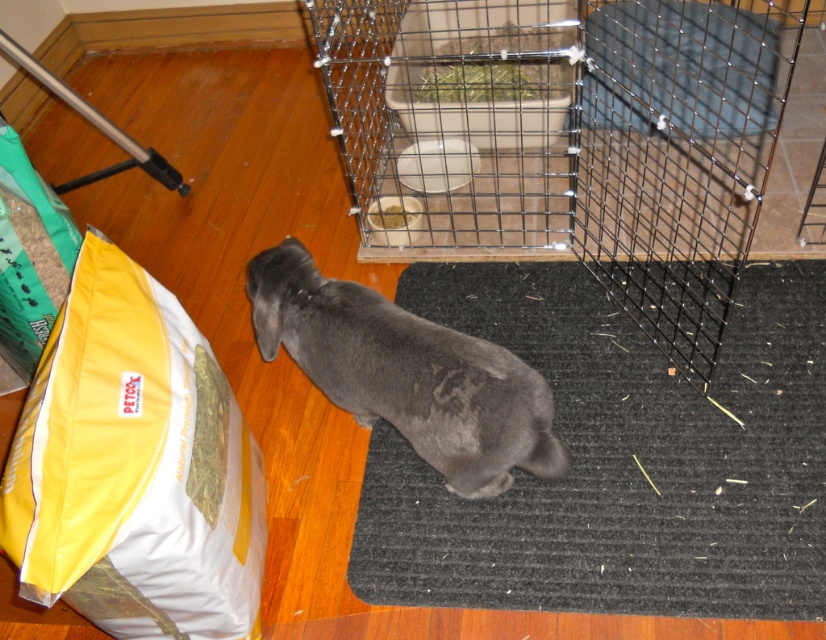
Consider the image. Measure the distance between smooth metal tray at upper center and green paper bag at left.

A distance of 1.44 meters exists between smooth metal tray at upper center and green paper bag at left.

Does point (724, 120) come farther from viewer compared to point (53, 202)?

Yes.

Does point (677, 70) come in front of point (7, 212)?

No, (677, 70) is behind (7, 212).

This screenshot has width=826, height=640. Identify the location of smooth metal tray at upper center. (680, 68).

Is black rubber mat at lower center wider than gray matte dog at center?

Correct, the width of black rubber mat at lower center exceeds that of gray matte dog at center.

Does black rubber mat at lower center have a smaller size compared to gray matte dog at center?

No.

Is point (741, 548) farther from viewer compared to point (305, 284)?

No.

You are a GUI agent. You are given a task and a screenshot of the screen. Output one action in this format:
    pyautogui.click(x=<x>, y=<y>)
    Task: Click on the black rubber mat at lower center
    This screenshot has width=826, height=640.
    Given the screenshot: What is the action you would take?
    pyautogui.click(x=620, y=460)

Does black wire cage at center appear on the right side of yellow fabric bag at lower left?

Correct, you'll find black wire cage at center to the right of yellow fabric bag at lower left.

Is black wire cage at center below yellow fabric bag at lower left?

No, black wire cage at center is not below yellow fabric bag at lower left.

Which is behind, point (727, 241) or point (40, 449)?

Point (727, 241)

Locate an element on the screen. The image size is (826, 640). black wire cage at center is located at coordinates click(573, 136).